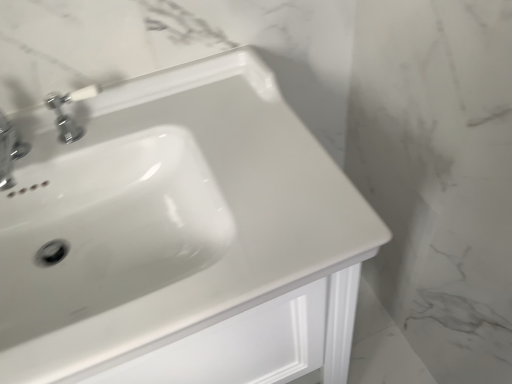
Identify the location of vacant space to the right of chrome metallic faucet at upper left, the first tap when ordered from right to left. The width and height of the screenshot is (512, 384). (167, 122).